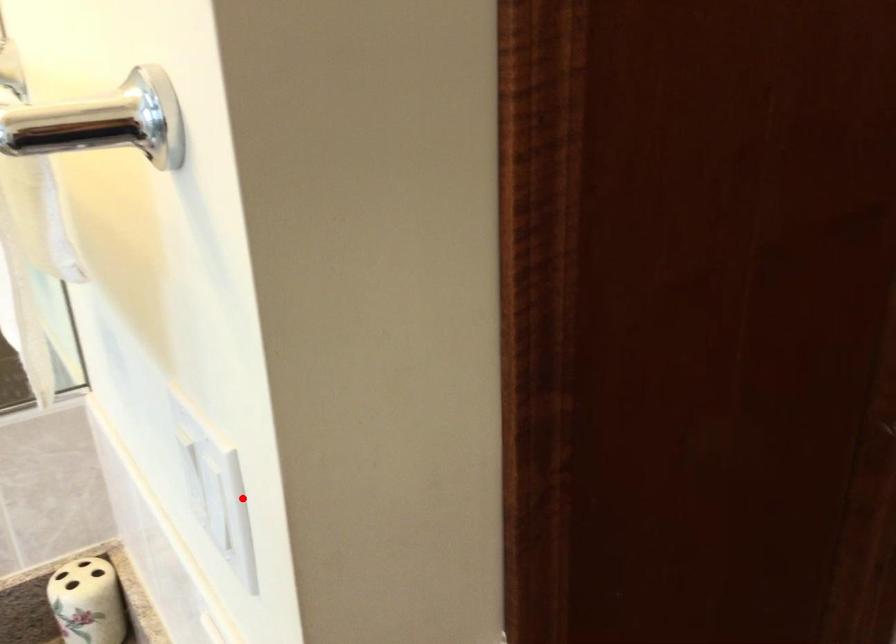
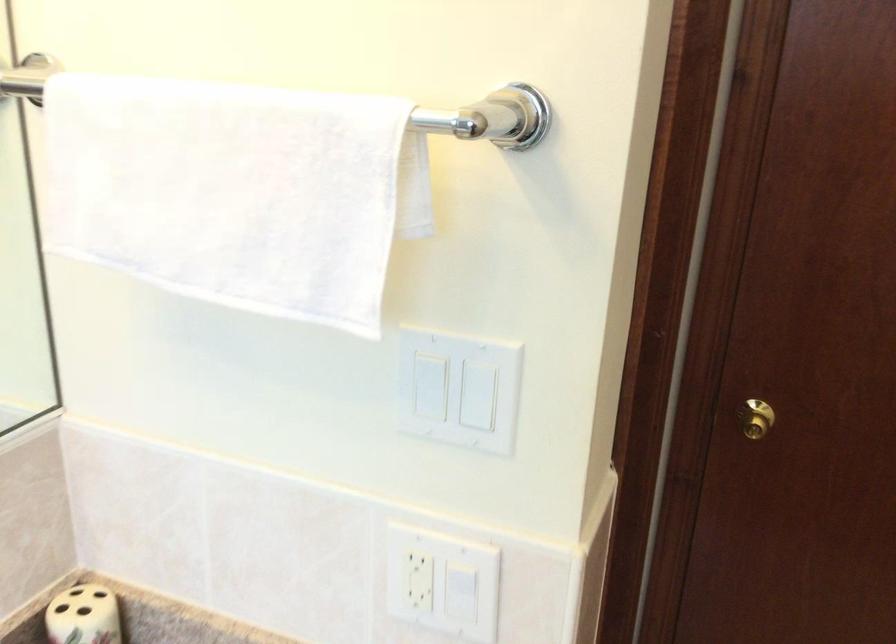
Question: A red point is marked in image1. In image2, is the corresponding 3D point closer to the camera or farther? Reply with the corresponding letter.

Choices:
 (A) The corresponding 3D point is closer.
 (B) The corresponding 3D point is farther.

Answer: (B)